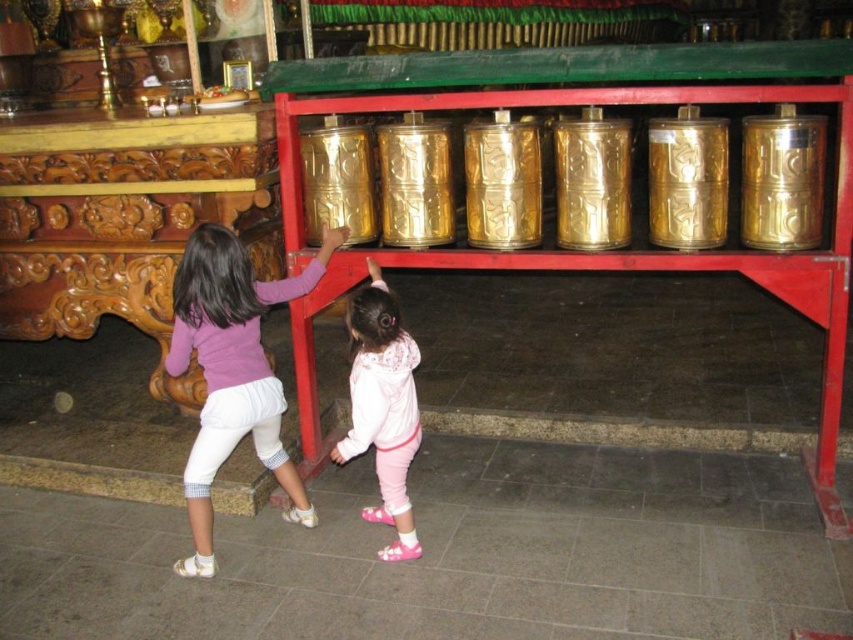
Question: Is purple cotton shirt at lower left positioned in front of pink fleece jacket at center?

Choices:
 (A) no
 (B) yes

Answer: (A)

Question: Does purple cotton shirt at lower left appear over pink fleece jacket at center?

Choices:
 (A) yes
 (B) no

Answer: (A)

Question: Does purple cotton shirt at lower left have a greater width compared to pink fleece jacket at center?

Choices:
 (A) no
 (B) yes

Answer: (B)

Question: Which point is farther to the camera?

Choices:
 (A) purple cotton shirt at lower left
 (B) pink fleece jacket at center

Answer: (A)